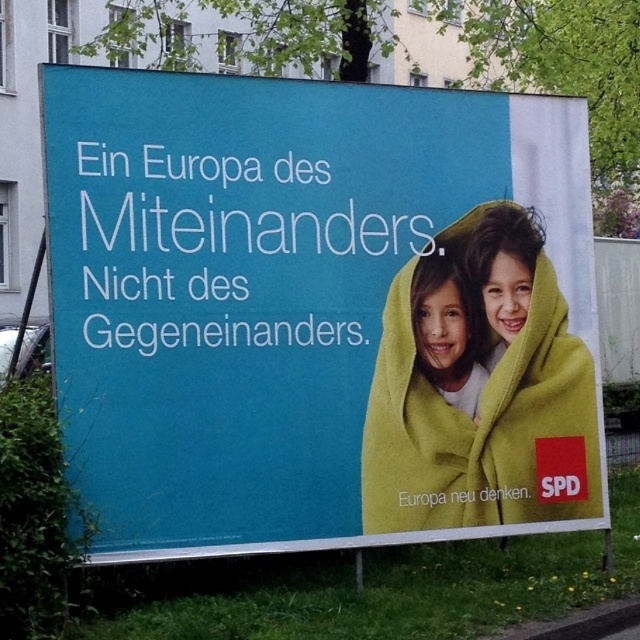
Consider the image. What is the relationship between the matte yellow blanket at center and the smooth yellow blanket at center on the billboard?

The matte yellow blanket at center is positioned over the smooth yellow blanket at center, indicating that the matte one is covering the smooth one.

You are a photographer trying to capture both the matte yellow blanket at center and the smooth yellow blanket at center in a single shot. Given that your camera has a maximum focus range of 14 inches, will you be able to focus on both blankets simultaneously?

The distance between the matte yellow blanket at center and the smooth yellow blanket at center is 14.39 inches, which exceeds the camera maximum focus range of 14 inches. Therefore, you cannot focus on both blankets simultaneously.